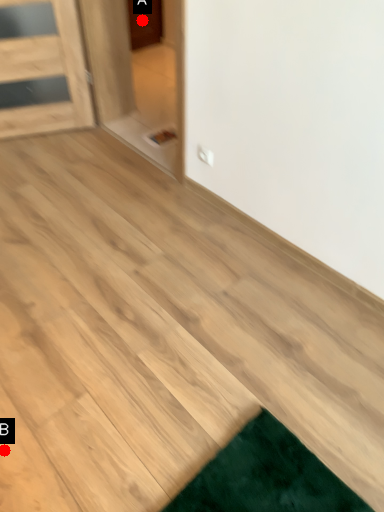
Question: Two points are circled on the image, labeled by A and B beside each circle. Which of the following is the farthest from the observer?

Choices:
 (A) A is further
 (B) B is further

Answer: (A)